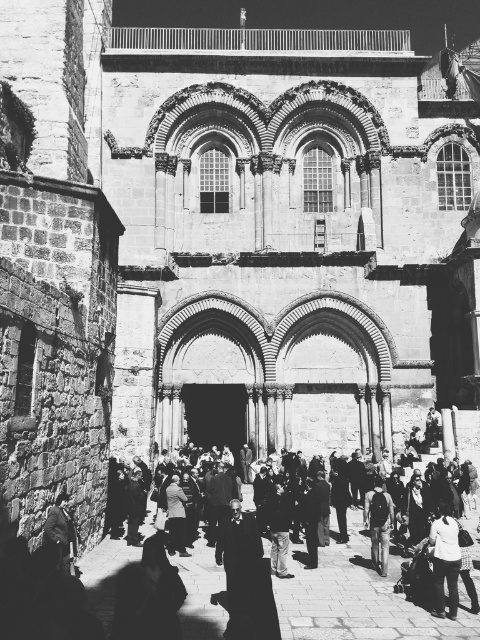
You are a tour guide carrying a 20 meter long banner and need to place it between the dark gray backpack at center and the dark wool coat at lower left without overlapping any objects. Is this possible?

The distance between the dark gray backpack at center and the dark wool coat at lower left is 19.91 meters. Since the banner is 20 meters long, it would be too long to fit between them without overlapping the objects.

You are a photographer trying to capture a photo of the historic stone building. You notice two people in the foreground wearing a white cotton shirt at lower right and a dark wool coat at lower left. Which clothing item would appear bigger in your photo?

The white cotton shirt at lower right would appear bigger in the photo because it has a larger size compared to the dark wool coat at lower left.